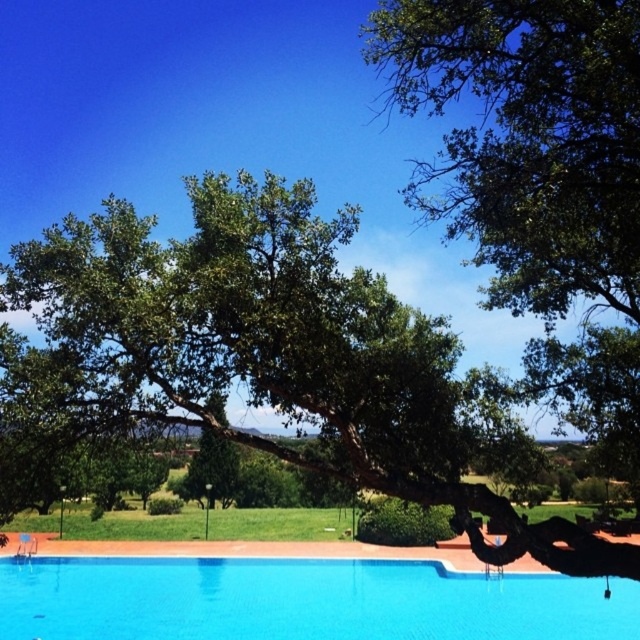
You are planning to install a new lighting system for the blue glassy swimming pool at center. The lighting system requires being placed under the green leafy oak tree at upper center. Is the tree tall enough to cover the entire pool area?

The green leafy oak tree at upper center is not as tall as the blue glassy swimming pool at center, so it cannot cover the entire pool area.

You are planning to install a new lighting system around the green leafy oak tree at upper center and the blue glassy swimming pool at center. The lighting system requires that the object it is installed on must be wider than 2 meters. Can both objects accommodate the lighting system?

The green leafy oak tree at upper center is thinner than the blue glassy swimming pool at center. Since the tree is thinner than the pool, but the pool is wider than 2 meters, the swimming pool can accommodate the lighting system. However, the tree might be too thin to meet the width requirement unless its actual width is over 2 meters.